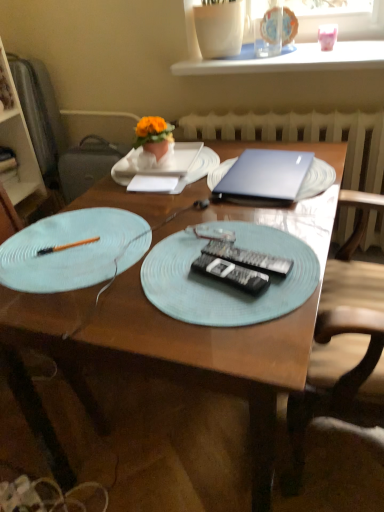
I want to click on free spot below light blue textured plate at left, placed as the second plate when sorted from front to back (from a real-world perspective), so click(95, 252).